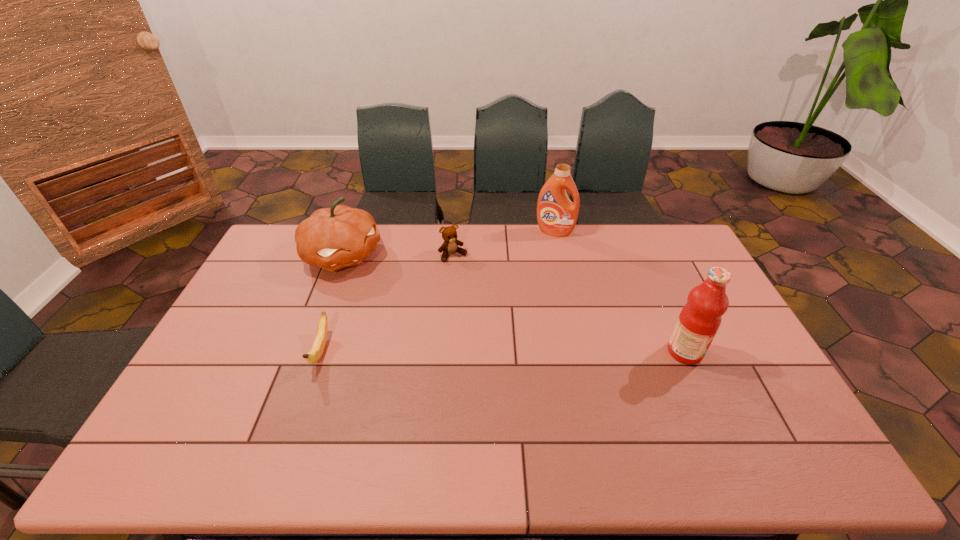
Find the location of `the shortest object`. the shortest object is located at coordinates pos(315,353).

This screenshot has width=960, height=540. I want to click on the rightmost object, so click(699, 320).

What are the coordinates of `the third object from right to left` in the screenshot? It's located at (449, 234).

Locate an element on the screen. Image resolution: width=960 pixels, height=540 pixels. teddy bear is located at coordinates (449, 234).

At what (x,y) coordinates should I click in order to perform the action: click on the fourth object from left to right. Please return your answer as a coordinate pair (x, y). Looking at the image, I should click on (556, 215).

Where is `pumpkin`? Image resolution: width=960 pixels, height=540 pixels. pumpkin is located at coordinates (332, 238).

The width and height of the screenshot is (960, 540). In order to click on blank area located 0.080m at the stem of the shortest object in this screenshot , I will do `click(303, 402)`.

At what (x,y) coordinates should I click in order to perform the action: click on vacant position located 0.140m on the front label of the fruit juice. Please return your answer as a coordinate pair (x, y). Looking at the image, I should click on (751, 352).

Where is `free space located 0.220m on the front-facing side of the third object from right to left`? This screenshot has width=960, height=540. free space located 0.220m on the front-facing side of the third object from right to left is located at coordinates (487, 300).

Identify the location of vacant region located 0.290m on the front-facing side of the third object from right to left. The height and width of the screenshot is (540, 960). (496, 314).